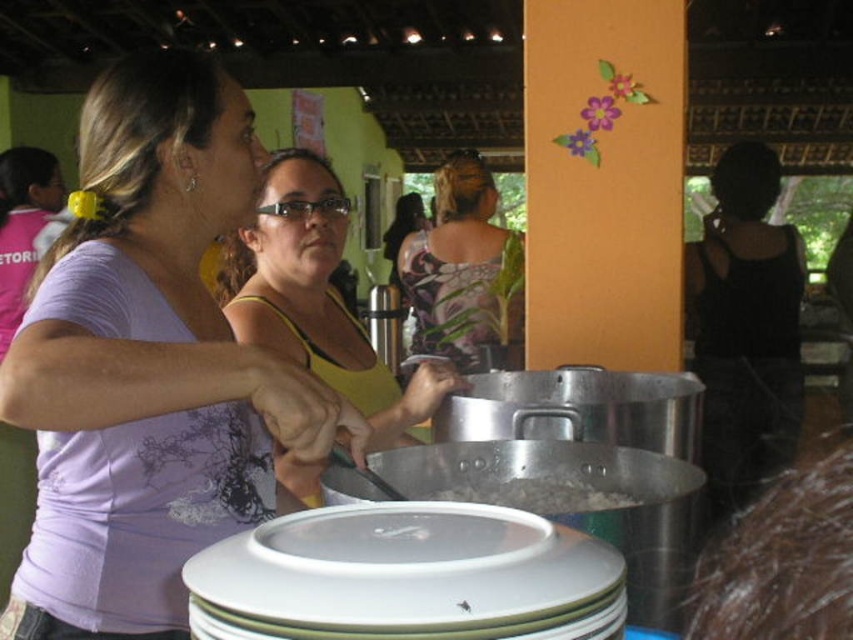
You are a person standing in the communal dining area and you want to grab the gray metallic rice at center without touching the black matte tank top at right. Is this possible?

The black matte tank top at right is located above the gray metallic rice at center, so you can reach down to grab the gray metallic rice at center without touching the black matte tank top at right.

You are a food server at the communal dining area. You need to determine which object is larger between the black matte tank top at right and the gray metallic rice at center. Which one is larger?

The black matte tank top at right is bigger than the gray metallic rice at center.